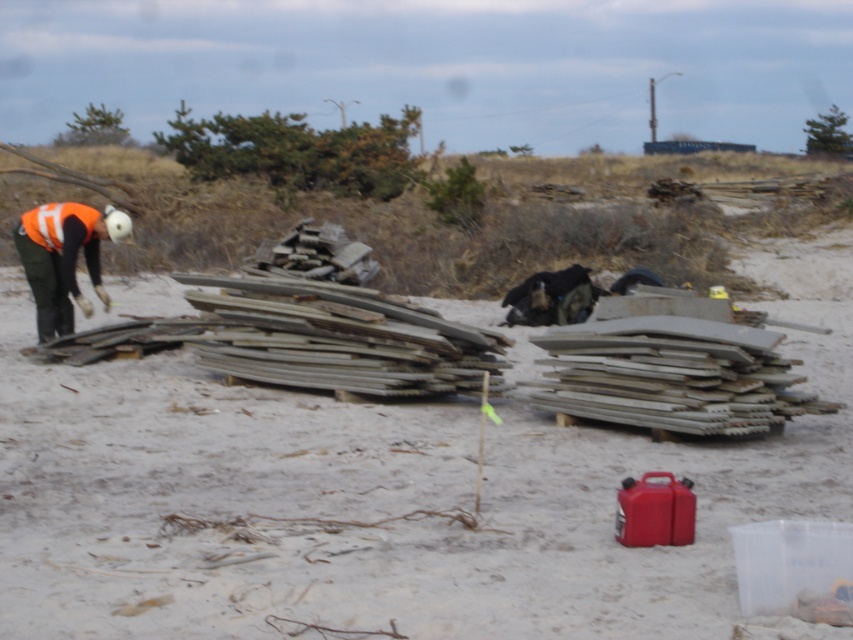
Question: Is white sandy beach at center smaller than orange reflective vest at left?

Choices:
 (A) yes
 (B) no

Answer: (B)

Question: Is white sandy beach at center in front of orange reflective vest at left?

Choices:
 (A) no
 (B) yes

Answer: (B)

Question: Which point appears farthest from the camera in this image?

Choices:
 (A) (12, 522)
 (B) (67, 321)

Answer: (B)

Question: Does white sandy beach at center appear over orange reflective vest at left?

Choices:
 (A) no
 (B) yes

Answer: (A)

Question: Which point is farther to the camera?

Choices:
 (A) (79, 204)
 (B) (625, 600)

Answer: (A)